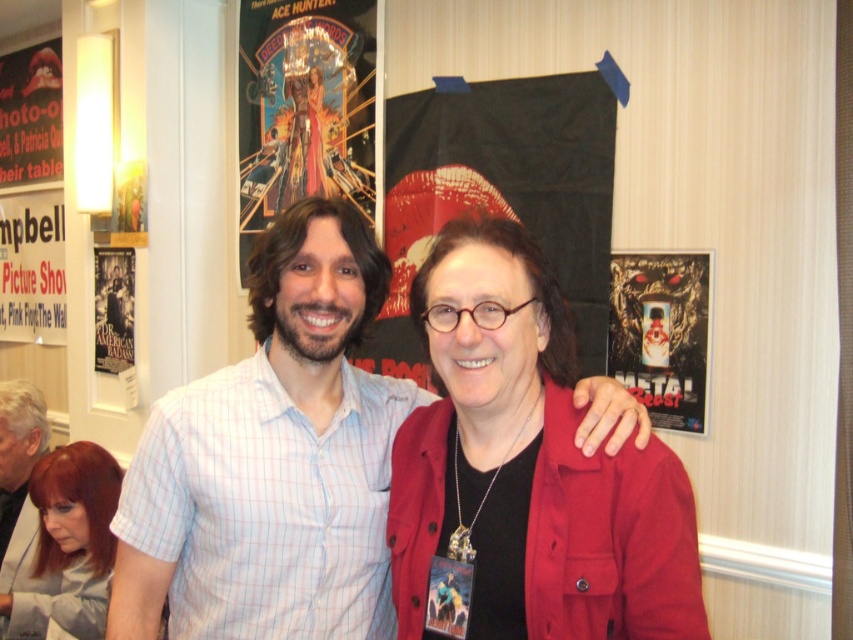
Which of these two, shiny red hair at lower left or matte black poster at left, stands shorter?

shiny red hair at lower left

Is point (9, 560) positioned before point (109, 349)?

Yes, point (9, 560) is in front of point (109, 349).

This screenshot has height=640, width=853. I want to click on shiny red hair at lower left, so click(62, 547).

Measure the distance between matte red jacket at center and metallic poster at upper center.

They are 6.24 feet apart.

Which is below, matte red jacket at center or metallic poster at upper center?

matte red jacket at center

Which is behind, point (550, 528) or point (277, 122)?

The point (277, 122) is more distant.

Locate an element on the screen. matte red jacket at center is located at coordinates (527, 467).

Which of these two, metallic silver poster at upper right or white paper poster at left, stands shorter?

metallic silver poster at upper right is shorter.

Is metallic silver poster at upper right positioned at the back of white paper poster at left?

No, metallic silver poster at upper right is closer to the viewer.

What do you see at coordinates (660, 333) in the screenshot?
I see `metallic silver poster at upper right` at bounding box center [660, 333].

Locate an element on the screen. This screenshot has height=640, width=853. metallic silver poster at upper right is located at coordinates (660, 333).